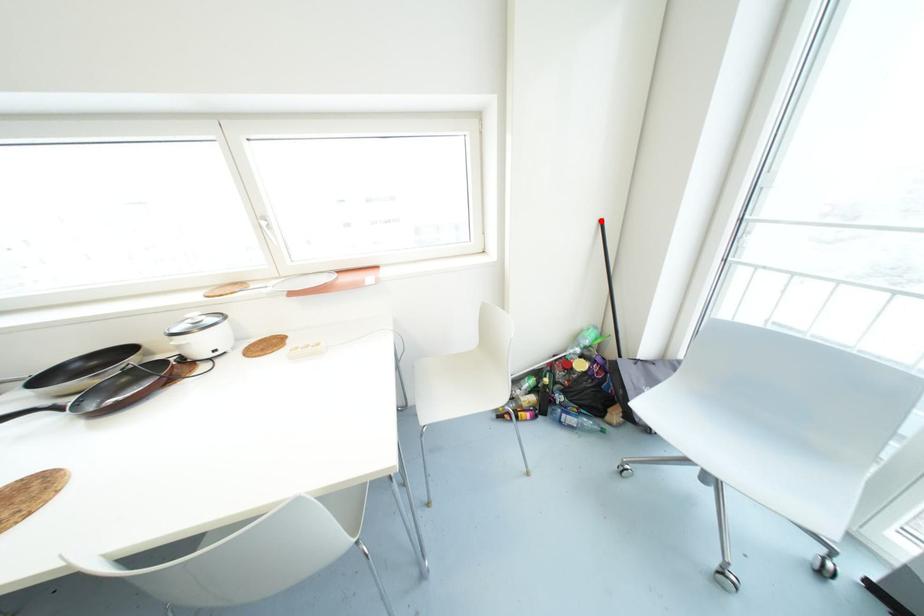
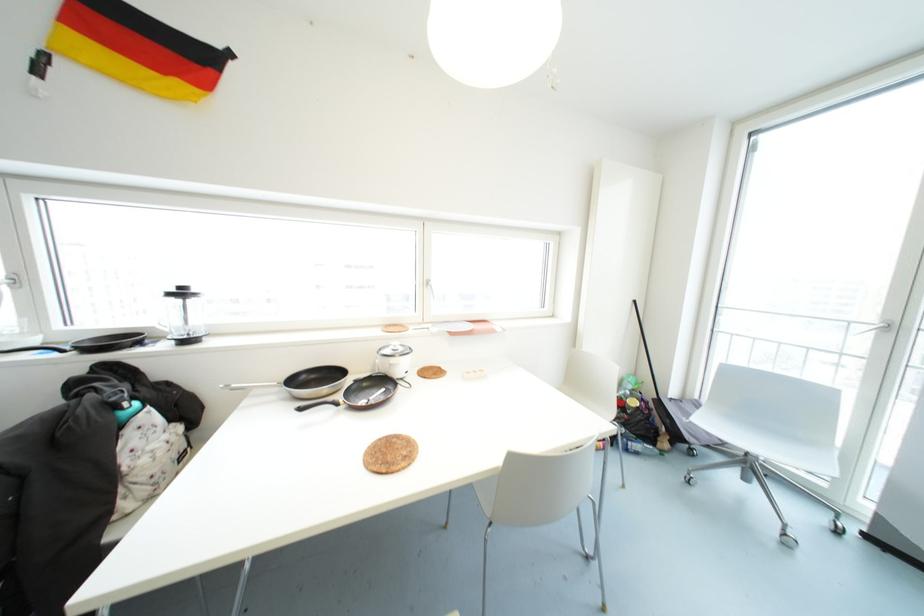
Where in the second image is the point corresponding to the highlighted location from the first image?

(634, 301)